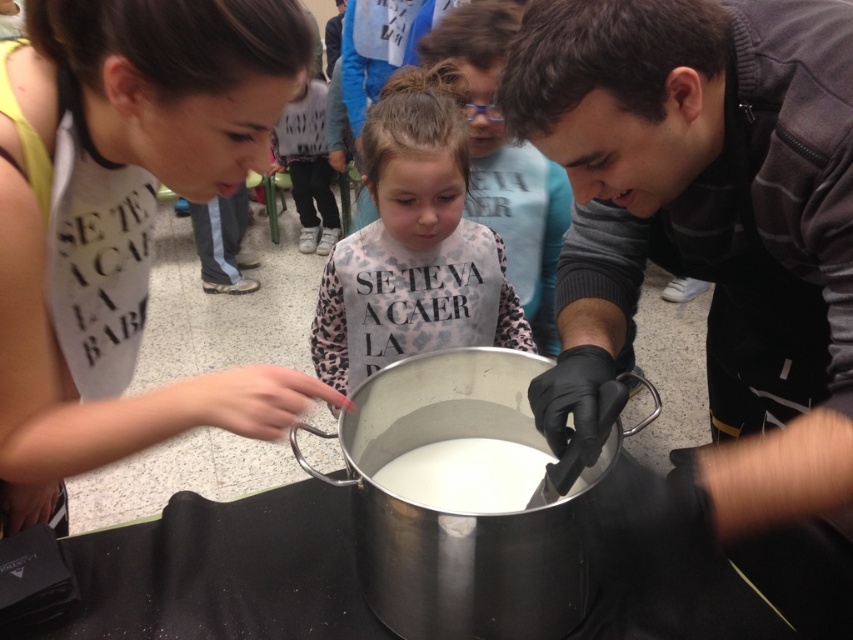
Who is taller, metallic silver pot at center or white leopard print sweater at center?

With more height is white leopard print sweater at center.

Can you confirm if metallic silver pot at center is shorter than white leopard print sweater at center?

Indeed, metallic silver pot at center has a lesser height compared to white leopard print sweater at center.

This screenshot has width=853, height=640. What do you see at coordinates (706, 220) in the screenshot?
I see `metallic silver pot at center` at bounding box center [706, 220].

You are a GUI agent. You are given a task and a screenshot of the screen. Output one action in this format:
    pyautogui.click(x=<x>, y=<y>)
    Task: Click on the metallic silver pot at center
    
    Given the screenshot: What is the action you would take?
    pyautogui.click(x=706, y=220)

Image resolution: width=853 pixels, height=640 pixels. Describe the element at coordinates (416, 161) in the screenshot. I see `leopard print sweater at center` at that location.

Which is more to the left, leopard print sweater at center or white glossy liquid at center?

Positioned to the left is leopard print sweater at center.

Image resolution: width=853 pixels, height=640 pixels. I want to click on leopard print sweater at center, so click(x=416, y=161).

Between point (525, 205) and point (427, 445), which one is positioned behind?

The point (525, 205) is behind.

Is white leopard print sweater at center thinner than white glossy liquid at center?

In fact, white leopard print sweater at center might be wider than white glossy liquid at center.

Between point (520, 147) and point (538, 490), which one is positioned behind?

Positioned behind is point (520, 147).

Identify the location of white leopard print sweater at center. The image size is (853, 640). (505, 161).